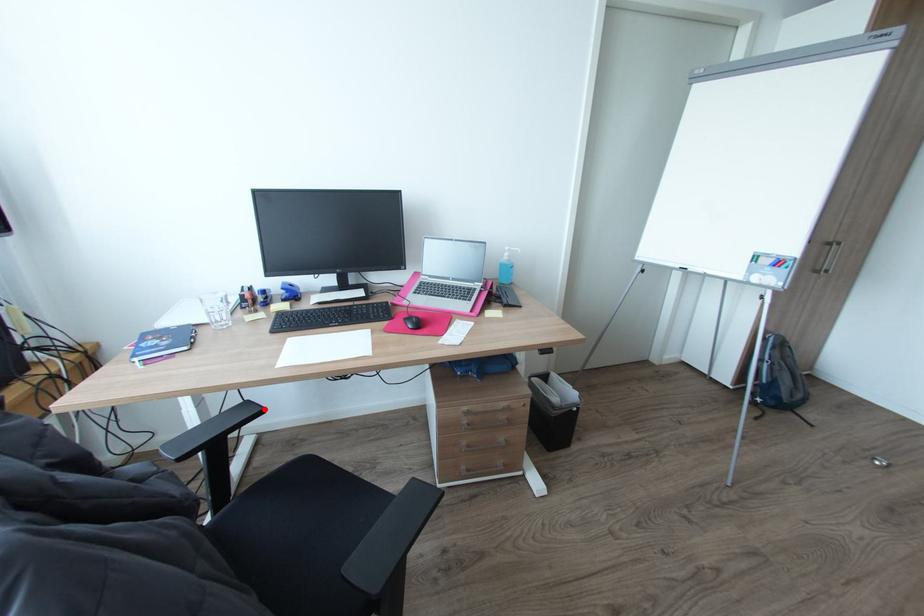
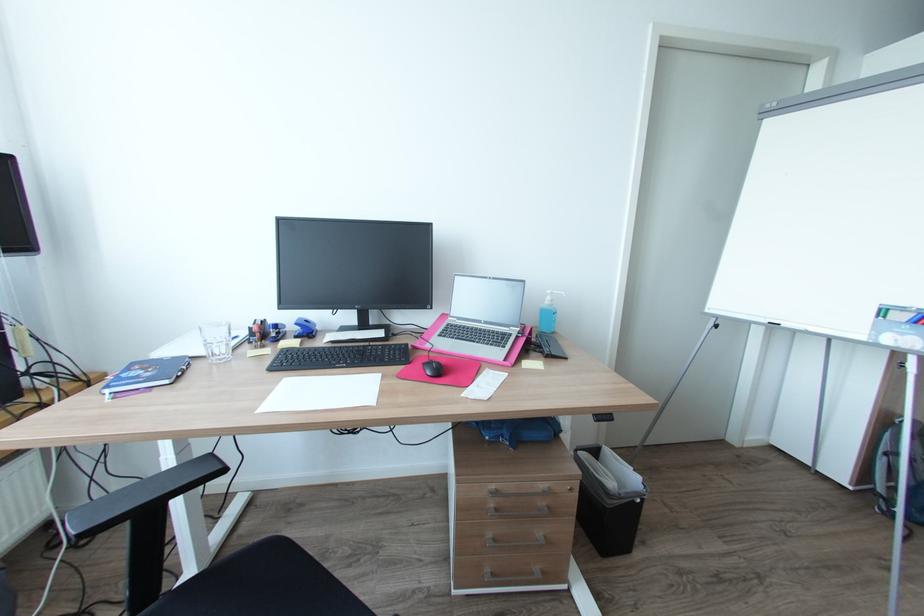
In the second image, find the point that corresponds to the highlighted location in the first image.

(223, 468)